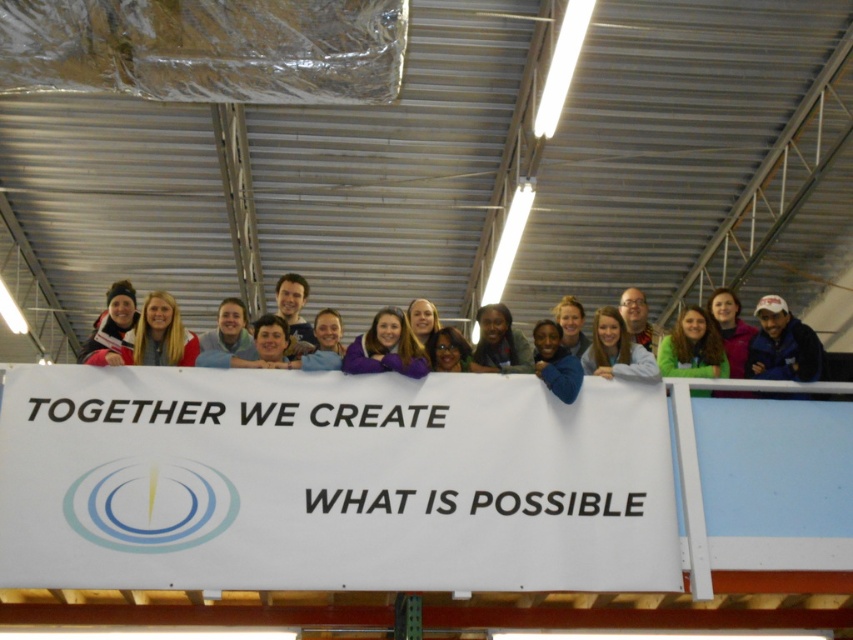
Question: Does matte blue jacket at center have a greater width compared to light brown hair at center?

Choices:
 (A) no
 (B) yes

Answer: (B)

Question: Is light brown hair at center thinner than matte black jacket at left?

Choices:
 (A) yes
 (B) no

Answer: (A)

Question: Which point is farther to the camera?

Choices:
 (A) (380, 364)
 (B) (602, 346)
 (C) (102, 312)
 (D) (508, 340)

Answer: (C)

Question: Considering the real-world distances, which object is closest to the matte blue jacket at center?

Choices:
 (A) matte purple sweater at center
 (B) light brown hair at center

Answer: (B)

Question: Which point is closer to the camera?

Choices:
 (A) matte black jacket at center
 (B) matte purple sweater at center
 (C) matte blue jacket at center

Answer: (C)

Question: Does blue fabric cap at right have a greater width compared to matte black jacket at center?

Choices:
 (A) no
 (B) yes

Answer: (A)